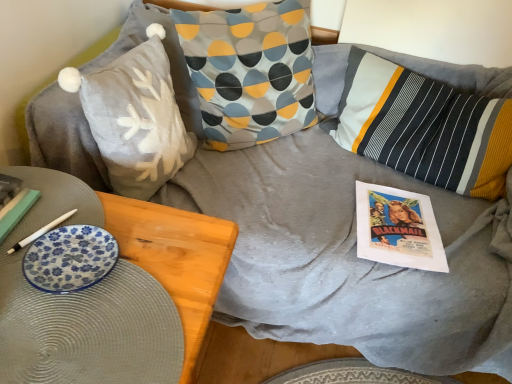
Question: Is point (258, 56) closer or farther from the camera than point (70, 284)?

Choices:
 (A) farther
 (B) closer

Answer: (A)

Question: Looking at their shapes, would you say patterned fabric pillow at center, which is counted as the 2th pillow, starting from the right, is wider or thinner than blue floral plate at lower left?

Choices:
 (A) thin
 (B) wide

Answer: (B)

Question: Considering the real-world distances, which object is closest to the striped cotton pillow at center, marked as the 1th pillow in a right-to-left arrangement?

Choices:
 (A) matte paper comic book at center right
 (B) patterned fabric pillow at center, the 2th pillow from the left
 (C) fuzzy gray pillow with white snowflake at upper left, acting as the 3th pillow starting from the right
 (D) blue glazed plate at left
 (E) matte paper magazine at lower left

Answer: (A)

Question: Estimate the real-world distances between objects in this image. Which object is closer to the matte paper comic book at center right?

Choices:
 (A) blue glazed plate at left
 (B) striped cotton pillow at center, the third pillow viewed from the left
 (C) matte paper magazine at lower left
 (D) patterned fabric pillow at center, the 2th pillow from the left
 (E) blue floral plate at lower left

Answer: (B)